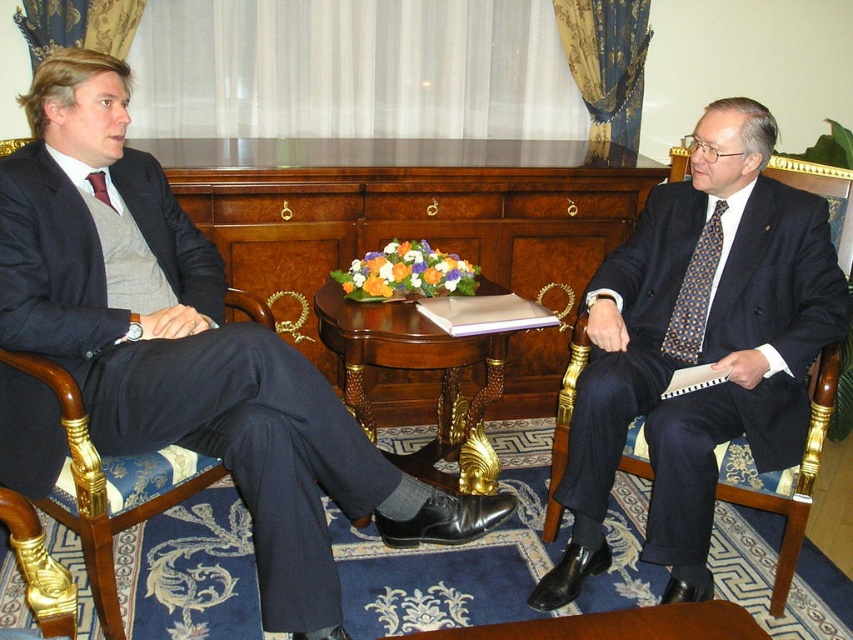
Who is positioned more to the left, polished dark blue suit at right or polka dot silk tie at right?

polished dark blue suit at right is more to the left.

You are a GUI agent. You are given a task and a screenshot of the screen. Output one action in this format:
    pyautogui.click(x=<x>, y=<y>)
    Task: Click on the polished dark blue suit at right
    
    Given the screenshot: What is the action you would take?
    point(698,348)

Is point (831, 292) farther from camera compared to point (692, 307)?

No.

This screenshot has width=853, height=640. In order to click on polished dark blue suit at right in this screenshot , I will do `click(698, 348)`.

Who is positioned more to the right, woodenobject at center or matte red tie at left?

woodenobject at center

Locate an element on the screen. This screenshot has width=853, height=640. woodenobject at center is located at coordinates (x=418, y=369).

Which of these two, matte black suit at left or woodenobject at center, stands shorter?

Standing shorter between the two is woodenobject at center.

Can you confirm if matte black suit at left is positioned below woodenobject at center?

Incorrect, matte black suit at left is not positioned below woodenobject at center.

Is point (33, 173) farther from viewer compared to point (482, 448)?

That is False.

The image size is (853, 640). What are the coordinates of `matte black suit at left` in the screenshot? It's located at (189, 348).